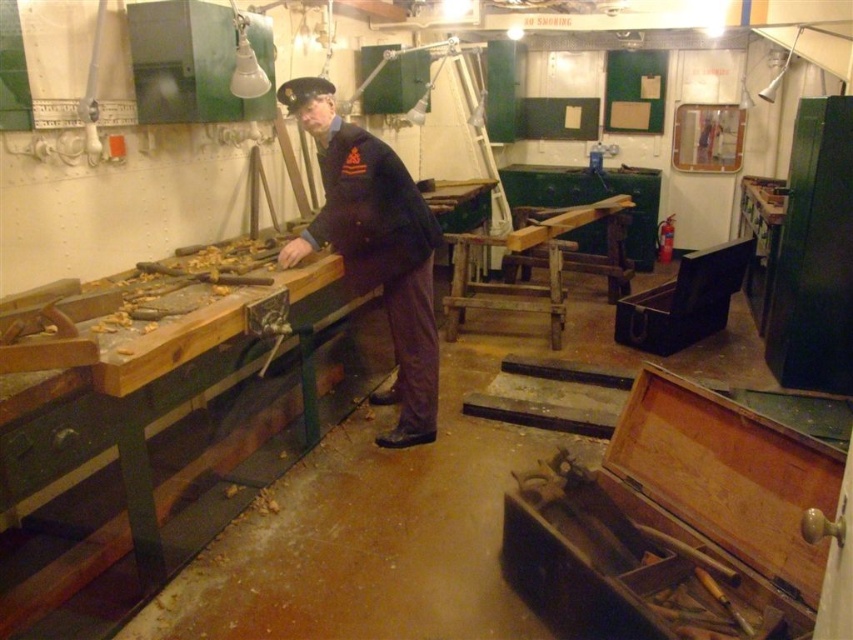
Who is more forward, (x=424, y=259) or (x=332, y=86)?

Point (x=332, y=86) is more forward.

Can you confirm if dark blue uniform at center is wider than black fabric cap at upper center?

Yes.

I want to click on dark blue uniform at center, so click(x=378, y=256).